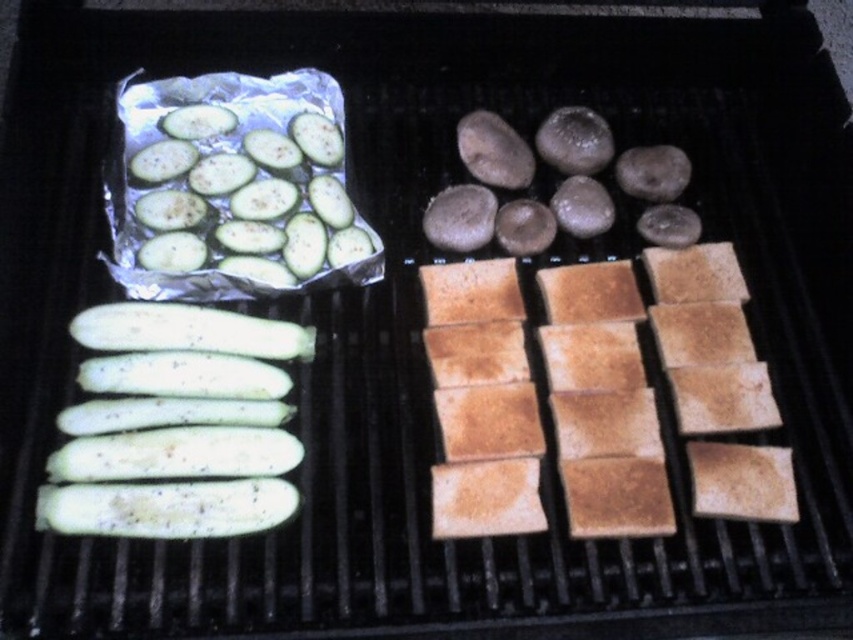
Based on the scene, where is the green matte cucumber at left located in terms of coordinates?

The green matte cucumber at left is located at coordinates point (x=178, y=426).

You are a chef preparing a meal and need to know which vegetable is shorter between the green matte cucumber at left and the green matte zucchini at upper left. Which one should you choose?

The green matte cucumber at left is shorter than the green matte zucchini at upper left, so you should choose the green matte cucumber at left.